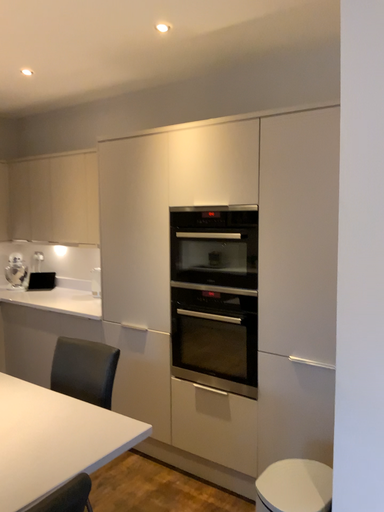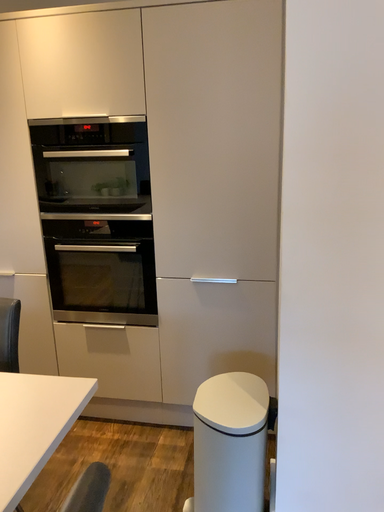
Question: Which way did the camera rotate in the video?

Choices:
 (A) rotated left
 (B) rotated right

Answer: (B)